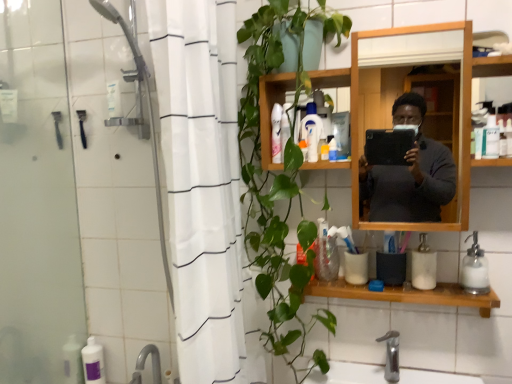
Question: Is translucent plastic toothbrush at upper center, the 7th toiletry when ordered from left to right, not within translucent plastic bottle at center, the sixth toiletry from the left?

Choices:
 (A) no
 (B) yes

Answer: (B)

Question: From a real-world perspective, is translucent plastic toothbrush at upper center, the seventh toiletry when ordered from top to bottom, below translucent plastic bottle at center, the third toiletry viewed from the right?

Choices:
 (A) no
 (B) yes

Answer: (B)

Question: Does translucent plastic toothbrush at upper center, the 2th toiletry when ordered from right to left, have a lesser width compared to translucent plastic bottle at center, the 6th toiletry viewed from the top?

Choices:
 (A) no
 (B) yes

Answer: (A)

Question: Can you confirm if translucent plastic toothbrush at upper center, the 6th toiletry viewed from the back, is positioned to the right of translucent plastic bottle at center, which ranks as the 5th toiletry in front-to-back order?

Choices:
 (A) yes
 (B) no

Answer: (A)

Question: Can you confirm if translucent plastic toothbrush at upper center, the seventh toiletry when ordered from top to bottom, is smaller than translucent plastic bottle at center, the third toiletry in the bottom-to-top sequence?

Choices:
 (A) yes
 (B) no

Answer: (A)

Question: From the image's perspective, is translucent plastic toothbrush at upper center, marked as the third toiletry in a front-to-back arrangement, on translucent plastic bottle at center, which is the 4th toiletry in back-to-front order?

Choices:
 (A) no
 (B) yes

Answer: (A)

Question: From a real-world perspective, is white plastic container at upper right, which appears as the first toiletry when viewed from the right, physically below white fabric shower curtain at left?

Choices:
 (A) yes
 (B) no

Answer: (B)

Question: Considering the relative sizes of white plastic container at upper right, which ranks as the eighth toiletry in left-to-right order, and white fabric shower curtain at left in the image provided, is white plastic container at upper right, which ranks as the eighth toiletry in left-to-right order, wider than white fabric shower curtain at left?

Choices:
 (A) no
 (B) yes

Answer: (A)

Question: Is white plastic container at upper right, which ranks as the fifth toiletry in bottom-to-top order, to the right of white fabric shower curtain at left from the viewer's perspective?

Choices:
 (A) yes
 (B) no

Answer: (A)

Question: Does white plastic container at upper right, which ranks as the eighth toiletry in left-to-right order, have a lesser height compared to white fabric shower curtain at left?

Choices:
 (A) yes
 (B) no

Answer: (A)

Question: Is white plastic container at upper right, which ranks as the eighth toiletry in left-to-right order, facing away from white fabric shower curtain at left?

Choices:
 (A) yes
 (B) no

Answer: (B)

Question: Is white plastic container at upper right, the eighth toiletry from the back, positioned behind white fabric shower curtain at left?

Choices:
 (A) no
 (B) yes

Answer: (B)